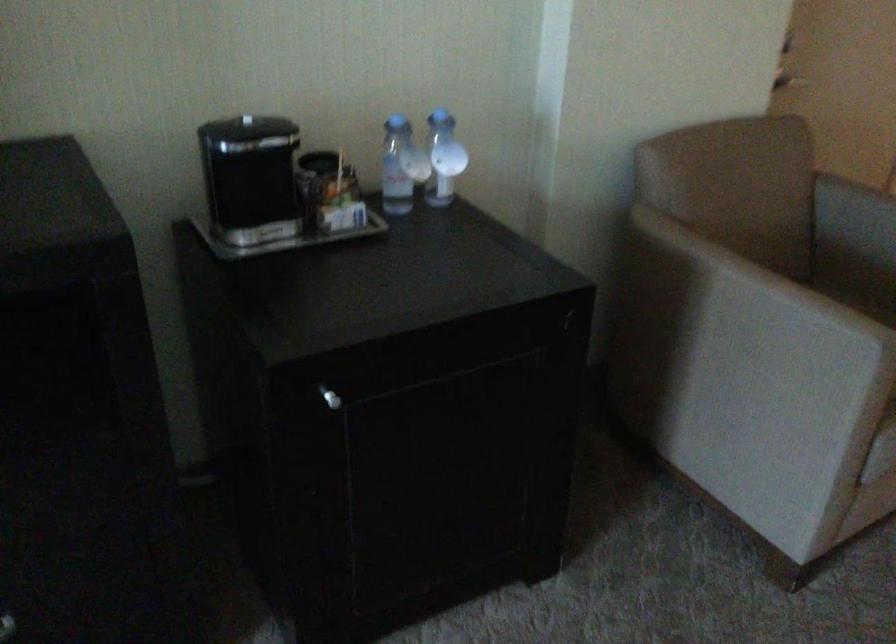
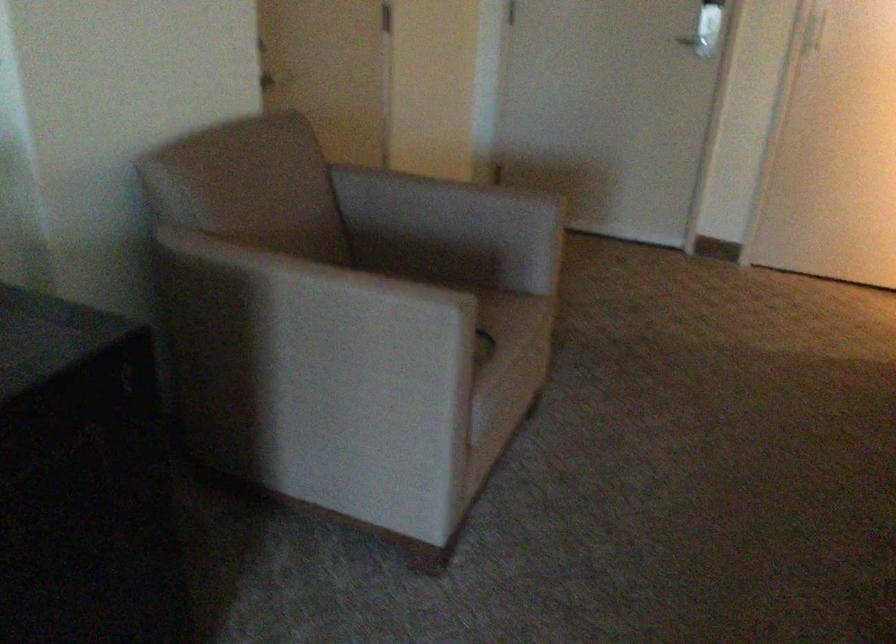
Question: The camera is either moving clockwise (left) or counter-clockwise (right) around the object. The first image is from the beginning of the video and the second image is from the end. Is the camera moving left or right when shooting the video?

Choices:
 (A) Left
 (B) Right

Answer: (A)